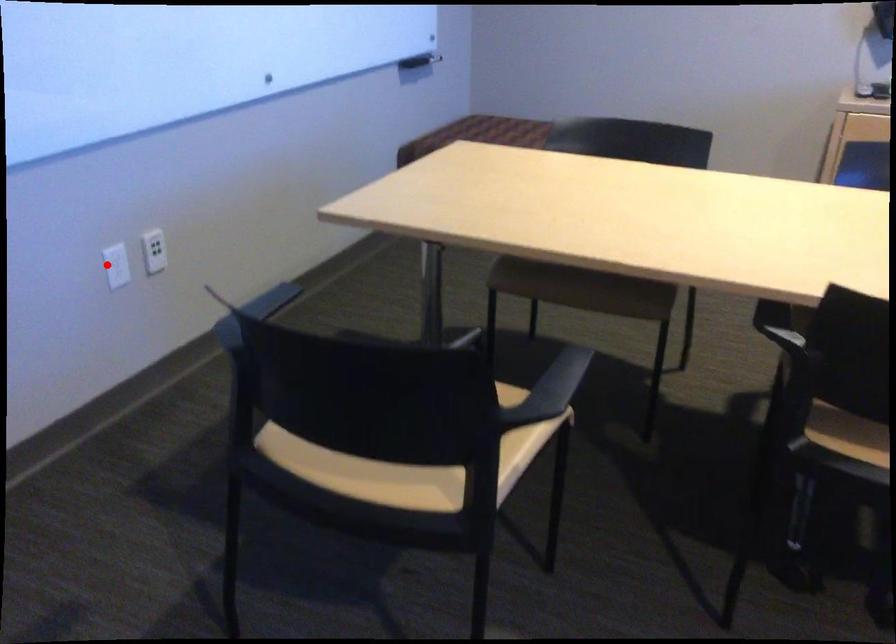
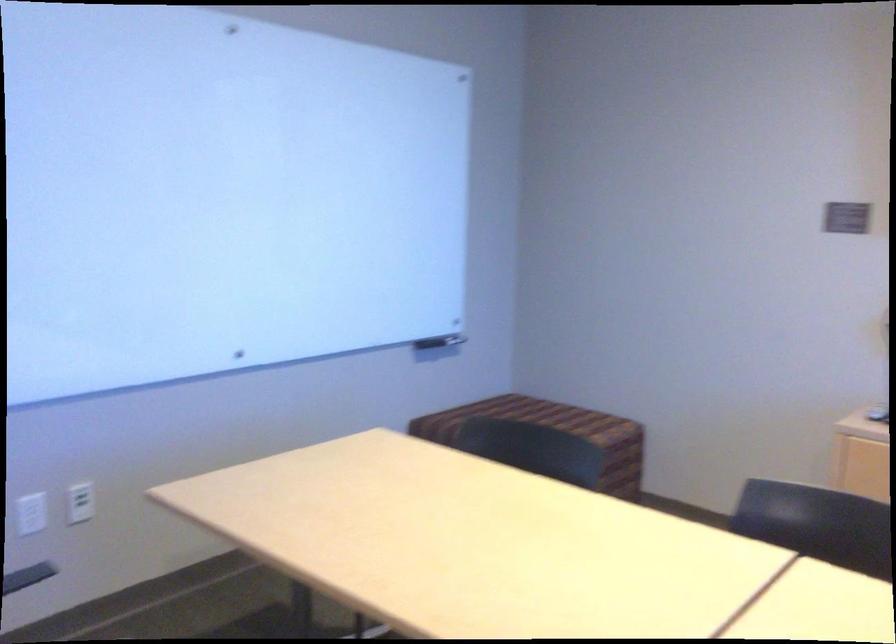
In the second image, find the point that corresponds to the highlighted location in the first image.

(30, 514)